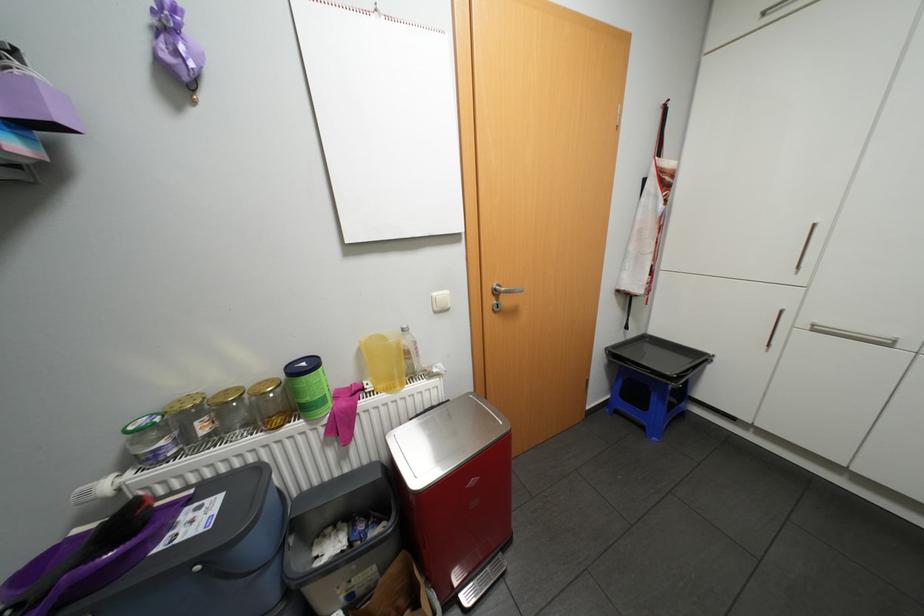
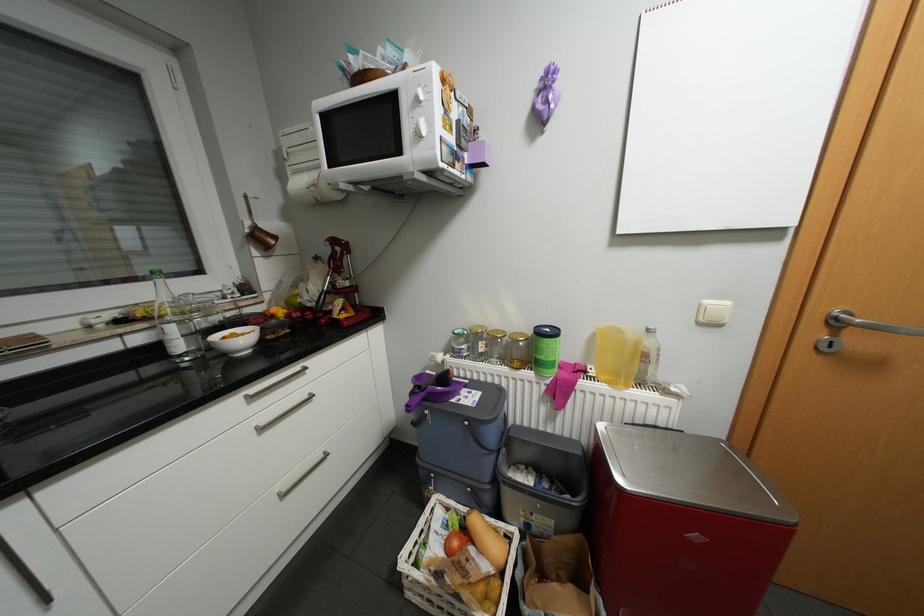
Question: The camera is either moving clockwise (left) or counter-clockwise (right) around the object. The first image is from the beginning of the video and the second image is from the end. Is the camera moving left or right when shooting the video?

Choices:
 (A) Left
 (B) Right

Answer: (B)